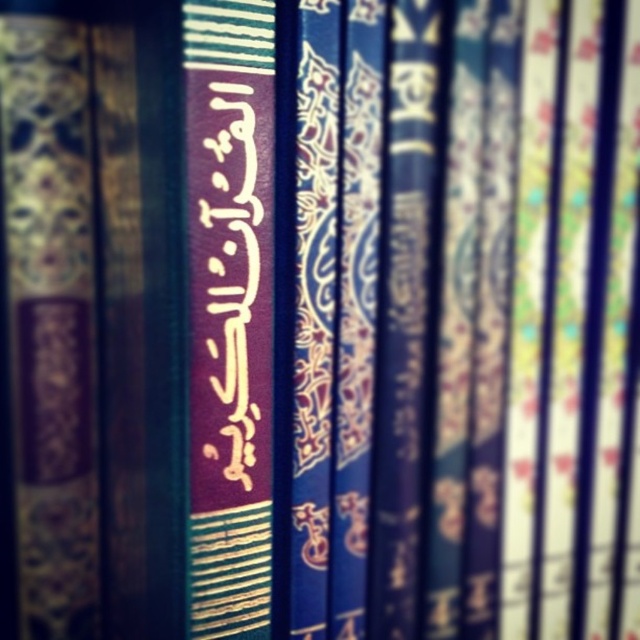
Question: Is matte gold text at center thinner than dark purple paper at center?

Choices:
 (A) no
 (B) yes

Answer: (A)

Question: Does matte gold text at center appear on the left side of dark purple paper at center?

Choices:
 (A) yes
 (B) no

Answer: (A)

Question: Which of the following is the farthest from the observer?

Choices:
 (A) matte gold text at center
 (B) dark purple paper at center

Answer: (B)

Question: Can you confirm if matte gold text at center is positioned to the left of dark purple paper at center?

Choices:
 (A) yes
 (B) no

Answer: (A)